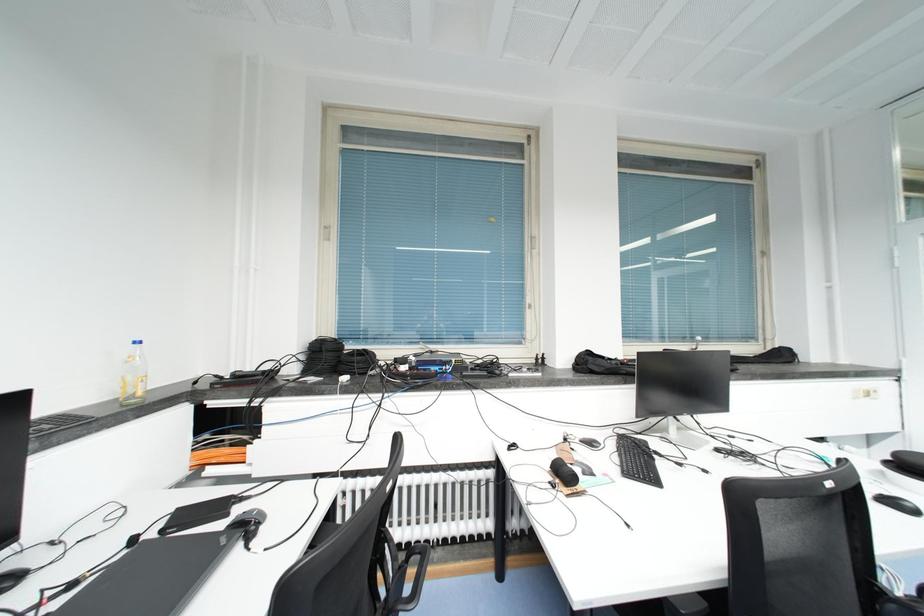
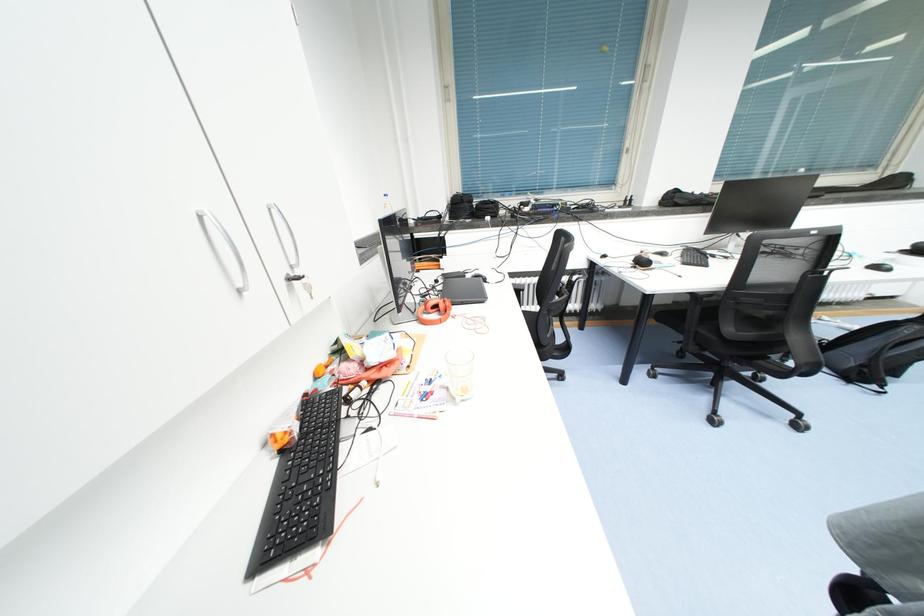
Question: The images are taken continuously from a first-person perspective. In which direction is your viewpoint rotating?

Choices:
 (A) Left
 (B) Right
 (C) Up
 (D) Down

Answer: (D)